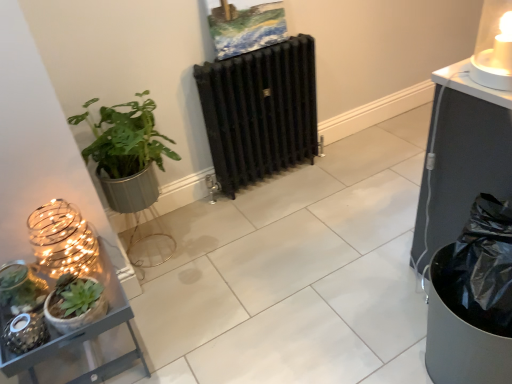
You are a GUI agent. You are given a task and a screenshot of the screen. Output one action in this format:
    pyautogui.click(x=<x>, y=<y>)
    Task: Click on the free spot below green matte plant at left, the 1th houseplant when ordered from back to front (from a real-world perspective)
    
    Given the screenshot: What is the action you would take?
    pyautogui.click(x=162, y=236)